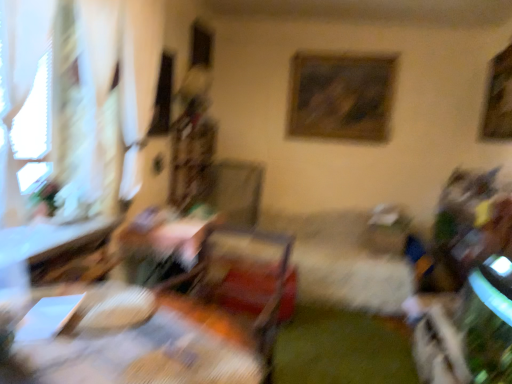
Question: Is wooden swivel chair at center wider or thinner than wooden framed painting at upper center, which appears as the second picture frame when viewed from the front?

Choices:
 (A) thin
 (B) wide

Answer: (B)

Question: In terms of size, does wooden swivel chair at center appear bigger or smaller than wooden framed painting at upper center, the 2th picture frame from the right?

Choices:
 (A) small
 (B) big

Answer: (B)

Question: Based on their relative distances, which object is farther from the wooden framed picture at upper right, the 2th picture frame viewed from the left?

Choices:
 (A) white sheer curtain at left
 (B) white sheer curtain at left
 (C) wooden table at center, placed as the 1th table when sorted from front to back
 (D) wooden table at left, the 2th table when ordered from front to back
 (E) wooden framed painting at upper center, the first picture frame from the left

Answer: (B)

Question: Which of these objects is positioned closest to the wooden table at center, marked as the second table in a back-to-front arrangement?

Choices:
 (A) white sheer curtain at left
 (B) wooden framed picture at upper right, which is the 1th picture frame in front-to-back order
 (C) wooden table at left, the first table in the back-to-front sequence
 (D) wooden swivel chair at center
 (E) white sheer curtain at left

Answer: (D)